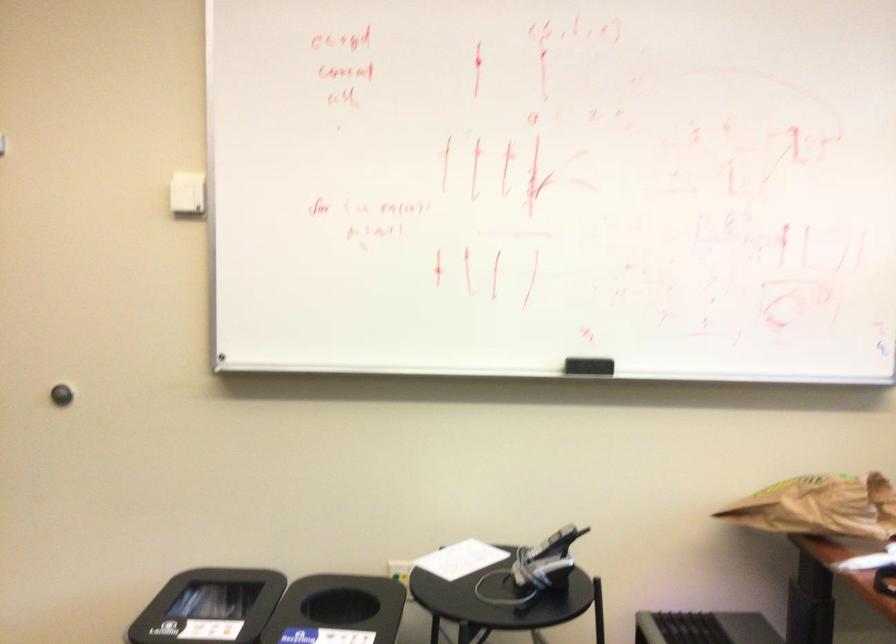
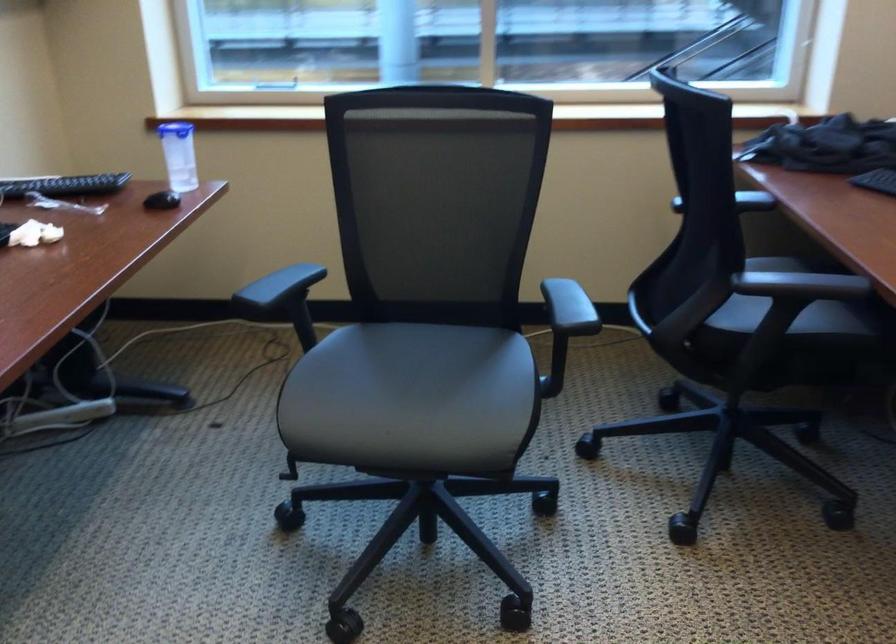
How did the camera likely rotate?

The camera rotated toward right-down.